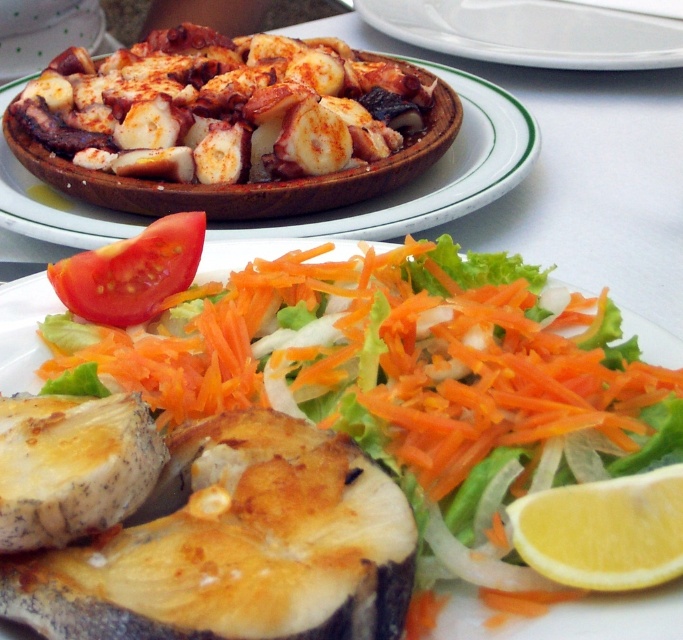
Question: Which object is the farthest from the red smooth tomato at upper left?

Choices:
 (A) yellow smooth lemon at lower right
 (B) golden-brown fried fish at center
 (C) wooden plate at center
 (D) white ceramic plate at upper center

Answer: (D)

Question: Is wooden plate at center to the left of yellow smooth lemon at lower right from the viewer's perspective?

Choices:
 (A) yes
 (B) no

Answer: (A)

Question: Can you confirm if golden-brown fried fish at center is positioned below red smooth tomato at upper left?

Choices:
 (A) no
 (B) yes

Answer: (B)

Question: Which of the following is the farthest from the observer?

Choices:
 (A) (264, 253)
 (B) (419, 211)
 (C) (167, 288)

Answer: (B)

Question: Is wooden plate at center bigger than red smooth tomato at upper left?

Choices:
 (A) yes
 (B) no

Answer: (A)

Question: Among these objects, which one is nearest to the camera?

Choices:
 (A) yellow smooth lemon at lower right
 (B) white ceramic plate at upper center
 (C) golden-brown fried fish at center
 (D) wooden plate at center

Answer: (C)